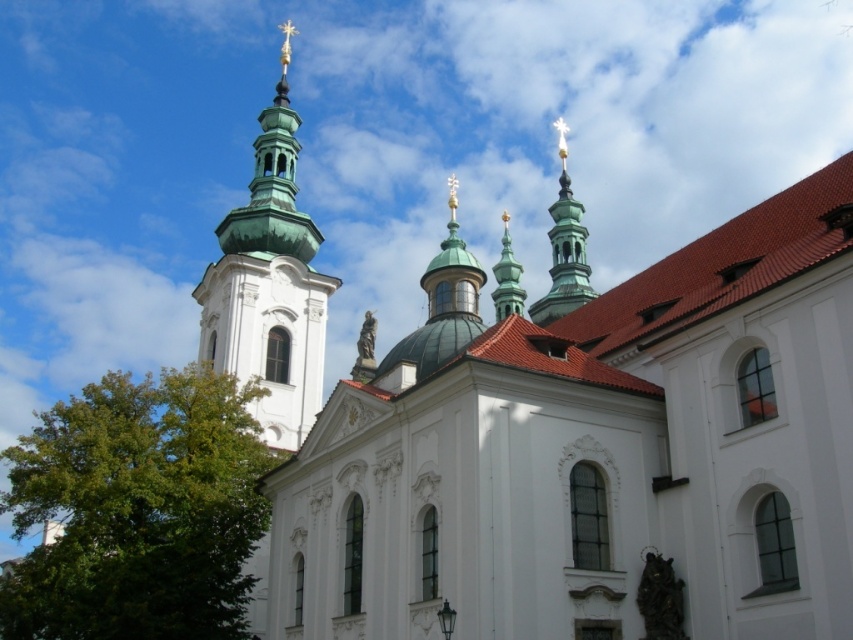
Can you confirm if green polished stone spire at upper center is thinner than green polished stone spire at center?

In fact, green polished stone spire at upper center might be wider than green polished stone spire at center.

The height and width of the screenshot is (640, 853). What do you see at coordinates (564, 250) in the screenshot?
I see `green polished stone spire at upper center` at bounding box center [564, 250].

Does point (575, 220) come in front of point (500, 307)?

No, it is not.

You are a GUI agent. You are given a task and a screenshot of the screen. Output one action in this format:
    pyautogui.click(x=<x>, y=<y>)
    Task: Click on the green polished stone spire at upper center
    The height and width of the screenshot is (640, 853).
    Given the screenshot: What is the action you would take?
    pyautogui.click(x=564, y=250)

Can you confirm if green smooth tower at upper left is positioned below green polished stone spire at center?

No, green smooth tower at upper left is not below green polished stone spire at center.

Which of these two, green smooth tower at upper left or green polished stone spire at center, stands shorter?

green polished stone spire at center is shorter.

Where is `green smooth tower at upper left`? green smooth tower at upper left is located at coordinates (270, 284).

At what (x,y) coordinates should I click in order to perform the action: click on green smooth tower at upper left. Please return your answer as a coordinate pair (x, y). This screenshot has height=640, width=853. Looking at the image, I should click on (270, 284).

Who is lower down, green smooth tower at upper left or green polished stone spire at upper center?

green polished stone spire at upper center is below.

The image size is (853, 640). I want to click on green smooth tower at upper left, so click(270, 284).

Is point (308, 400) positioned in front of point (590, 288)?

Yes.

I want to click on green smooth tower at upper left, so click(x=270, y=284).